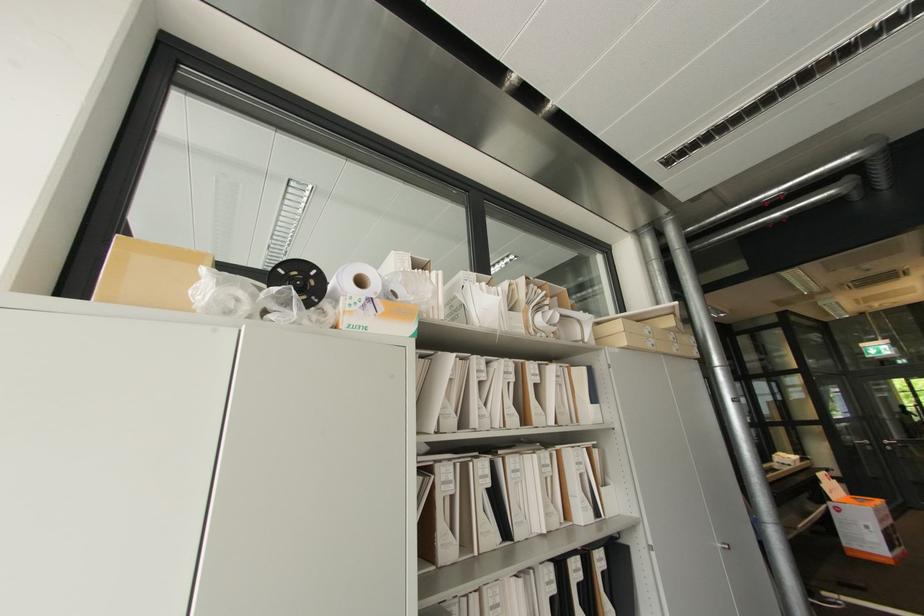
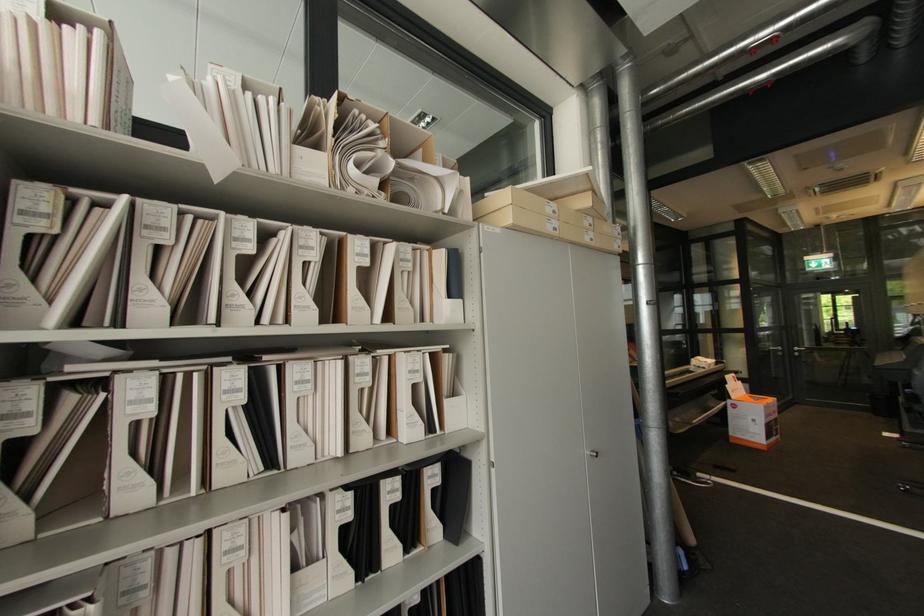
Find the pixel in the second image that matches [853,554] in the first image.

(736, 442)